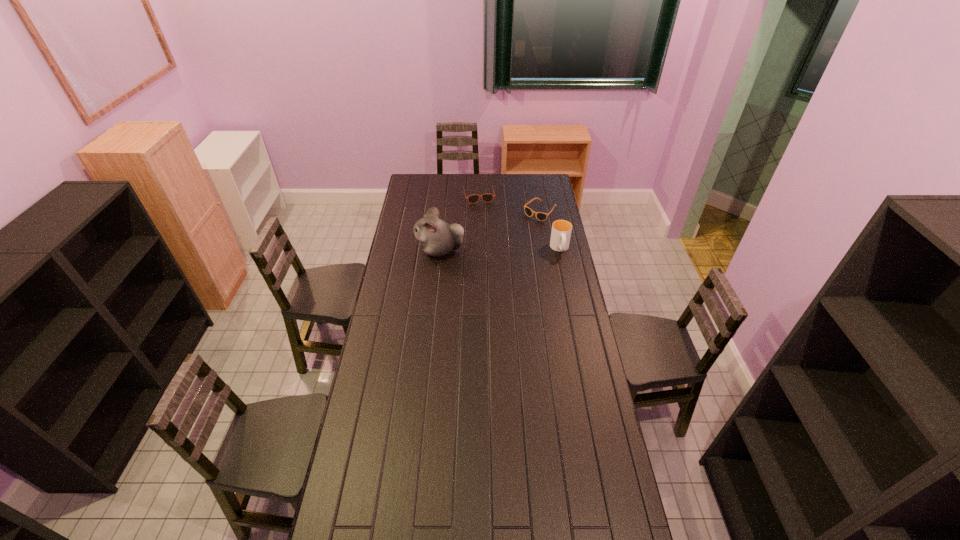
At what (x,y) coordinates should I click in order to perform the action: click on the tallest object. Please return your answer as a coordinate pair (x, y). Looking at the image, I should click on (437, 238).

Locate an element on the screen. The width and height of the screenshot is (960, 540). cup is located at coordinates click(x=561, y=229).

The image size is (960, 540). What are the coordinates of `the left sunglasses` in the screenshot? It's located at (487, 197).

This screenshot has width=960, height=540. In order to click on the right sunglasses in this screenshot , I will do `click(540, 216)`.

Where is `free region located 0.110m on the face of the hamster`? Image resolution: width=960 pixels, height=540 pixels. free region located 0.110m on the face of the hamster is located at coordinates (395, 251).

Identify the location of vacant area situated 0.080m on the face of the hamster. This screenshot has height=540, width=960. (400, 251).

Where is `vacant space located with the handle on the side of the cup`? The image size is (960, 540). vacant space located with the handle on the side of the cup is located at coordinates (573, 312).

Where is `free space located on the front-facing side of the left sunglasses`? This screenshot has width=960, height=540. free space located on the front-facing side of the left sunglasses is located at coordinates (488, 231).

Locate an element on the screen. This screenshot has width=960, height=540. vacant space located on the front-facing side of the left sunglasses is located at coordinates (483, 213).

Identify the location of free point located 0.160m on the front-facing side of the left sunglasses. This screenshot has width=960, height=540. click(485, 220).